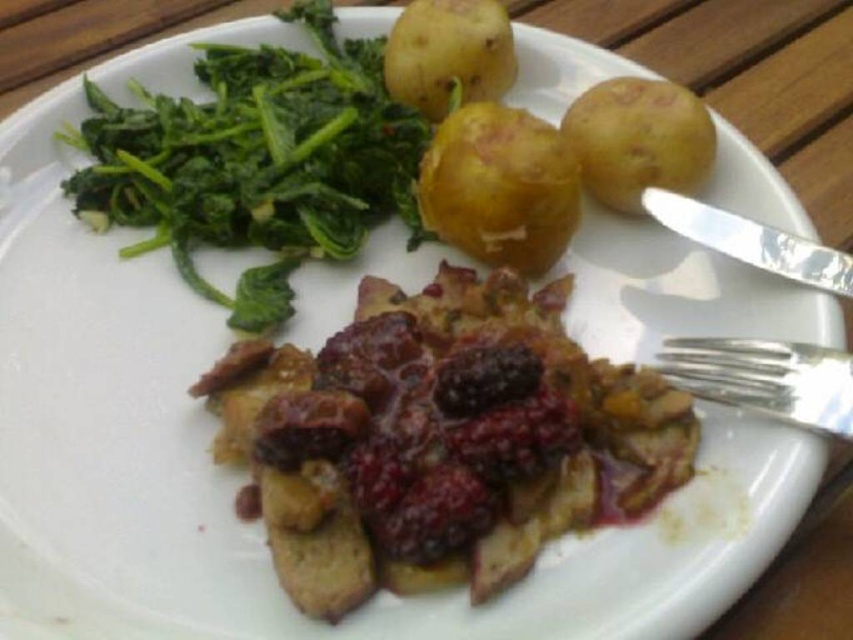
Question: Among these objects, which one is nearest to the camera?

Choices:
 (A) silver metallic knife at right
 (B) silver metallic fork at right
 (C) smooth yellow potato at upper center

Answer: (B)

Question: Which object appears farthest from the camera in this image?

Choices:
 (A) silver metallic fork at right
 (B) green leafy vegetable at upper left

Answer: (B)

Question: Can you confirm if silver metallic fork at right is smaller than silver metallic knife at right?

Choices:
 (A) no
 (B) yes

Answer: (B)

Question: Is green leafy vegetable at upper left thinner than silver metallic knife at right?

Choices:
 (A) yes
 (B) no

Answer: (B)

Question: Does brown crumbly bread at center appear on the left side of smooth yellow potato at upper center?

Choices:
 (A) no
 (B) yes

Answer: (B)

Question: Which of the following is the closest to the observer?

Choices:
 (A) (698, 355)
 (B) (485, 456)
 (C) (664, 113)

Answer: (B)